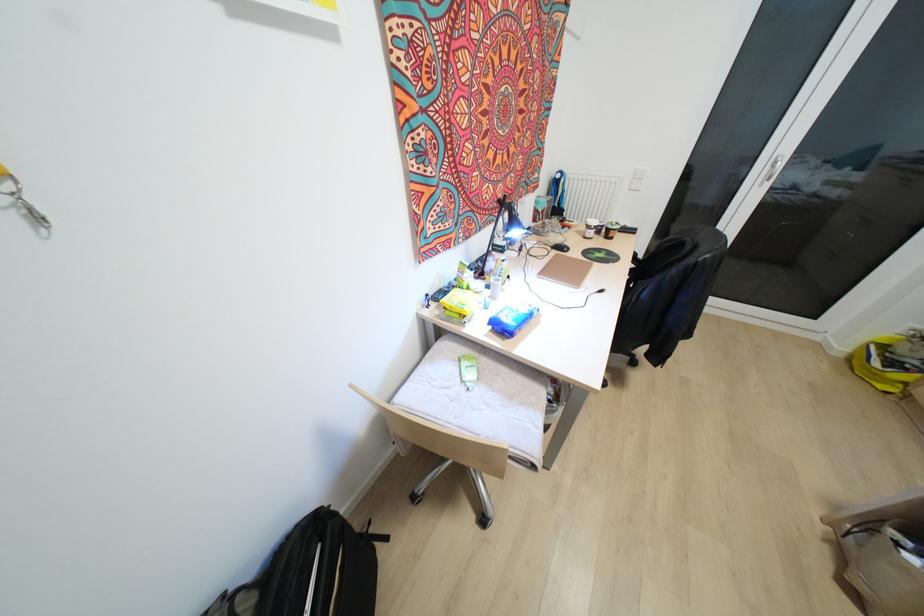
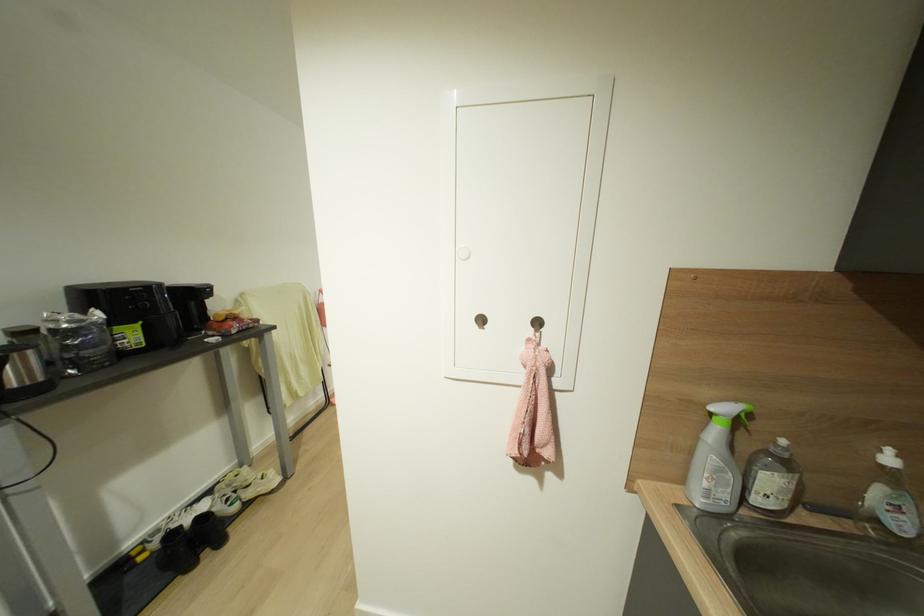
Question: I am providing you with two images of the same scene from different viewpoints. After the viewpoint changes to image2, which objects are now occluded?

Choices:
 (A) black backpack
 (B) brown ceramic mug
 (C) black cleaning brush
 (D) metal wall hook

Answer: (A)